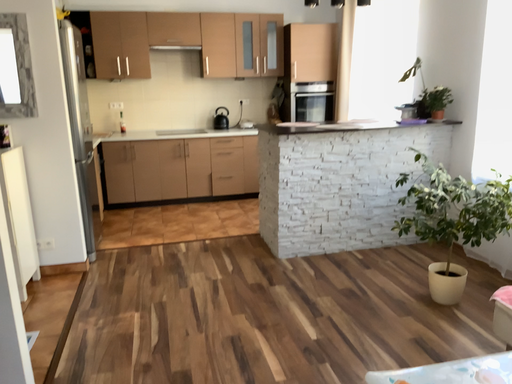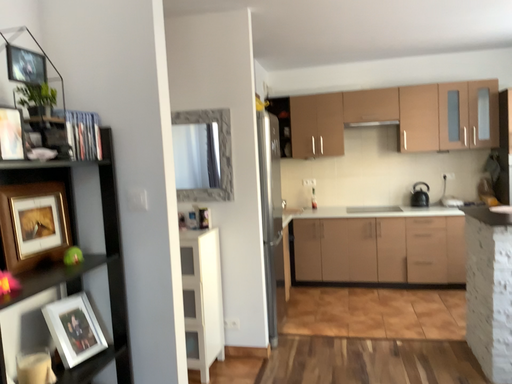
Question: Which way did the camera rotate in the video?

Choices:
 (A) rotated left
 (B) rotated right

Answer: (A)